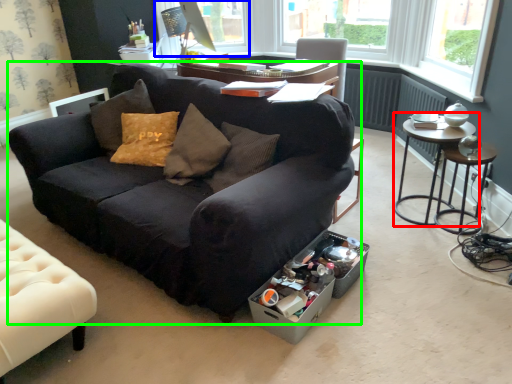
Question: Estimate the real-world distances between objects in this image. Which object is closer to table (highlighted by a red box), window screen (highlighted by a blue box) or studio couch (highlighted by a green box)?

Choices:
 (A) window screen
 (B) studio couch

Answer: (B)